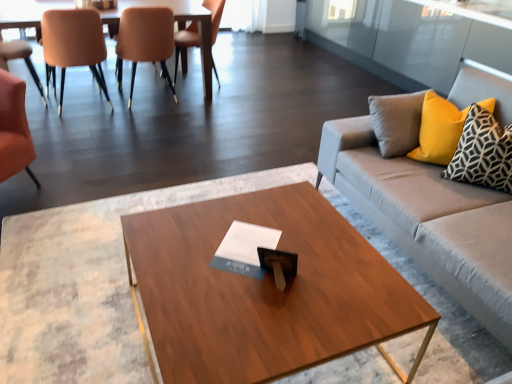
Find the location of a particular element. orange leather chair at left, the fourth chair viewed from the right is located at coordinates (14, 129).

Find the location of a particular element. This screenshot has height=384, width=512. matte orange chair at left, which is the third chair from right to left is located at coordinates (73, 45).

The height and width of the screenshot is (384, 512). Find the location of `wooden table at upper left`. wooden table at upper left is located at coordinates (179, 27).

From the image's perspective, relative to yellow fabric pillow at right, marked as the first pillow in a back-to-front arrangement, is wooden coffee table at center above or below?

From the image's perspective, wooden coffee table at center appears below yellow fabric pillow at right, marked as the first pillow in a back-to-front arrangement.

Do you think wooden coffee table at center is within yellow fabric pillow at right, marked as the first pillow in a back-to-front arrangement, or outside of it?

The correct answer is: outside.

Which of these two, wooden coffee table at center or yellow fabric pillow at right, marked as the first pillow in a back-to-front arrangement, is smaller?

yellow fabric pillow at right, marked as the first pillow in a back-to-front arrangement, is smaller.

Is wooden coffee table at center positioned behind orange leather chair at left, placed as the second chair when sorted from left to right?

No, wooden coffee table at center is closer to the viewer.

From the image's perspective, is wooden coffee table at center over orange leather chair at left, placed as the second chair when sorted from left to right?

No.

Considering the sizes of objects wooden coffee table at center and orange leather chair at left, the fourth chair viewed from the right, in the image provided, who is shorter, wooden coffee table at center or orange leather chair at left, the fourth chair viewed from the right,?

Standing shorter between the two is wooden coffee table at center.

Is orange leather chair at left, placed as the second chair when sorted from left to right, not close to yellow fabric pillow at right, which is the second pillow in back-to-front order?

Yes, orange leather chair at left, placed as the second chair when sorted from left to right, is far from yellow fabric pillow at right, which is the second pillow in back-to-front order.

Considering the positions of objects orange leather chair at left, placed as the second chair when sorted from left to right, and yellow fabric pillow at right, which is the second pillow in back-to-front order, in the image provided, who is more to the left, orange leather chair at left, placed as the second chair when sorted from left to right, or yellow fabric pillow at right, which is the second pillow in back-to-front order,?

From the viewer's perspective, orange leather chair at left, placed as the second chair when sorted from left to right, appears more on the left side.

From a real-world perspective, is orange leather chair at left, placed as the second chair when sorted from left to right, physically above yellow fabric pillow at right, arranged as the first pillow when viewed from the front?

Incorrect, from a real-world perspective, orange leather chair at left, placed as the second chair when sorted from left to right, is lower than yellow fabric pillow at right, arranged as the first pillow when viewed from the front.

Can yellow fabric pillow at right, which is the second pillow in back-to-front order, be found inside orange leather chair at left, placed as the second chair when sorted from left to right?

No, yellow fabric pillow at right, which is the second pillow in back-to-front order, is not a part of orange leather chair at left, placed as the second chair when sorted from left to right.

Considering the positions of point (146, 37) and point (469, 156), is point (146, 37) closer or farther from the camera than point (469, 156)?

Point (146, 37) is positioned farther from the camera compared to point (469, 156).

Would you say matte orange chair at left, arranged as the 2th chair when viewed from the right, is outside yellow fabric pillow at right, arranged as the first pillow when viewed from the front?

Yes, matte orange chair at left, arranged as the 2th chair when viewed from the right, is not within yellow fabric pillow at right, arranged as the first pillow when viewed from the front.

Is matte orange chair at left, the fourth chair in the left-to-right sequence, turned away from yellow fabric pillow at right, arranged as the first pillow when viewed from the front?

Yes, matte orange chair at left, the fourth chair in the left-to-right sequence, is facing away from yellow fabric pillow at right, arranged as the first pillow when viewed from the front.

In the scene shown: From the image's perspective, relative to yellow fabric pillow at right, arranged as the first pillow when viewed from the front, is matte orange chair at left, the fourth chair in the left-to-right sequence, above or below?

matte orange chair at left, the fourth chair in the left-to-right sequence, is situated higher than yellow fabric pillow at right, arranged as the first pillow when viewed from the front, in the image.

Is matte orange chair at left, the fourth chair in the left-to-right sequence, inside or outside of yellow fabric pillow at right, marked as the second pillow in a front-to-back arrangement?

matte orange chair at left, the fourth chair in the left-to-right sequence, is not enclosed by yellow fabric pillow at right, marked as the second pillow in a front-to-back arrangement.

Looking at this image, is matte orange chair at left, arranged as the 2th chair when viewed from the right, wider than yellow fabric pillow at right, marked as the first pillow in a back-to-front arrangement?

Yes, matte orange chair at left, arranged as the 2th chair when viewed from the right, is wider than yellow fabric pillow at right, marked as the first pillow in a back-to-front arrangement.

Between point (166, 17) and point (444, 126), which one is positioned behind?

The point (166, 17) is farther.

Looking at this image, which object is closer to the camera, matte orange chair at left, the fourth chair in the left-to-right sequence, or wooden coffee table at center?

Positioned in front is wooden coffee table at center.

Is matte orange chair at left, arranged as the 2th chair when viewed from the right, oriented away from wooden coffee table at center?

Yes, matte orange chair at left, arranged as the 2th chair when viewed from the right, is facing away from wooden coffee table at center.

Which of these two, matte orange chair at left, the fourth chair in the left-to-right sequence, or wooden coffee table at center, is thinner?

With smaller width is matte orange chair at left, the fourth chair in the left-to-right sequence.

Considering the relative sizes of matte orange chair at left, arranged as the 2th chair when viewed from the right, and wooden coffee table at center in the image provided, is matte orange chair at left, arranged as the 2th chair when viewed from the right, smaller than wooden coffee table at center?

Indeed, matte orange chair at left, arranged as the 2th chair when viewed from the right, has a smaller size compared to wooden coffee table at center.

How distant is yellow fabric pillow at right, marked as the second pillow in a front-to-back arrangement, from gray fabric couch at right?

A distance of 10.94 inches exists between yellow fabric pillow at right, marked as the second pillow in a front-to-back arrangement, and gray fabric couch at right.

Looking at the image, does yellow fabric pillow at right, marked as the first pillow in a back-to-front arrangement, seem bigger or smaller compared to gray fabric couch at right?

Considering their sizes, yellow fabric pillow at right, marked as the first pillow in a back-to-front arrangement, takes up less space than gray fabric couch at right.

Is yellow fabric pillow at right, marked as the first pillow in a back-to-front arrangement, at the right side of gray fabric couch at right?

In fact, yellow fabric pillow at right, marked as the first pillow in a back-to-front arrangement, is to the left of gray fabric couch at right.

Is yellow fabric pillow at right, marked as the first pillow in a back-to-front arrangement, positioned with its back to gray fabric couch at right?

Yes.

Find the location of a particular element. coffee table that appears in front of the yellow fabric pillow at right, marked as the first pillow in a back-to-front arrangement is located at coordinates (265, 290).

The image size is (512, 384). I want to click on coffee table on the right side of orange leather chair at left, placed as the second chair when sorted from left to right, so click(x=265, y=290).

Considering their positions, is leather chair at upper left, positioned as the 5th chair in left-to-right order, positioned further to matte orange chair at left, the 5th chair positioned from the right, than matte orange chair at left, arranged as the 2th chair when viewed from the right?

leather chair at upper left, positioned as the 5th chair in left-to-right order, is positioned further to the anchor matte orange chair at left, the 5th chair positioned from the right.

Considering their positions, is orange leather chair at left, the fourth chair viewed from the right, positioned closer to yellow fabric pillow at right, marked as the second pillow in a front-to-back arrangement, than matte orange chair at left, the 5th chair positioned from the right?

Among the two, orange leather chair at left, the fourth chair viewed from the right, is located nearer to yellow fabric pillow at right, marked as the second pillow in a front-to-back arrangement.

Which object lies nearer to the anchor point leather chair at upper left, positioned as the 5th chair in left-to-right order, orange leather chair at left, the fourth chair viewed from the right, or wooden table at upper left?

Based on the image, wooden table at upper left appears to be nearer to leather chair at upper left, positioned as the 5th chair in left-to-right order.

Looking at this image, based on their spatial positions, is matte orange chair at left, the 5th chair positioned from the right, or orange leather chair at left, placed as the second chair when sorted from left to right, closer to leather chair at upper left, arranged as the first chair when viewed from the right?

matte orange chair at left, the 5th chair positioned from the right.

From the image, which object appears to be nearer to matte orange chair at left, arranged as the 3th chair when viewed from the left, orange leather chair at left, the fourth chair viewed from the right, or yellow fabric pillow at right, which is the second pillow in back-to-front order?

orange leather chair at left, the fourth chair viewed from the right, is closer to matte orange chair at left, arranged as the 3th chair when viewed from the left.

When comparing their distances from matte orange chair at left, the fourth chair in the left-to-right sequence, does orange leather chair at left, the fourth chair viewed from the right, or wooden coffee table at center seem closer?

orange leather chair at left, the fourth chair viewed from the right.

Based on their spatial positions, is wooden table at upper left or orange leather chair at left, placed as the second chair when sorted from left to right, closer to matte orange chair at left, the fourth chair in the left-to-right sequence?

Based on the image, wooden table at upper left appears to be nearer to matte orange chair at left, the fourth chair in the left-to-right sequence.

Which object lies nearer to the anchor point orange leather chair at left, placed as the second chair when sorted from left to right, gray fabric couch at right or yellow fabric pillow at right, marked as the second pillow in a front-to-back arrangement?

Based on the image, gray fabric couch at right appears to be nearer to orange leather chair at left, placed as the second chair when sorted from left to right.

Identify the location of coffee table between wooden table at upper left and gray fabric couch at right in the horizontal direction. click(265, 290).

Find the location of `coffee table between orange leather chair at left, placed as the second chair when sorted from left to right, and yellow fabric pillow at right, arranged as the first pillow when viewed from the front, in the horizontal direction`. coffee table between orange leather chair at left, placed as the second chair when sorted from left to right, and yellow fabric pillow at right, arranged as the first pillow when viewed from the front, in the horizontal direction is located at coordinates (265, 290).

Where is `table between orange leather chair at left, the fourth chair viewed from the right, and matte orange chair at left, the fourth chair in the left-to-right sequence, from front to back`? table between orange leather chair at left, the fourth chair viewed from the right, and matte orange chair at left, the fourth chair in the left-to-right sequence, from front to back is located at coordinates (179, 27).

Where is `pillow between yellow fabric pillow at right, which is the second pillow in back-to-front order, and leather chair at upper left, arranged as the first chair when viewed from the right, from front to back`? This screenshot has height=384, width=512. pillow between yellow fabric pillow at right, which is the second pillow in back-to-front order, and leather chair at upper left, arranged as the first chair when viewed from the right, from front to back is located at coordinates (438, 130).